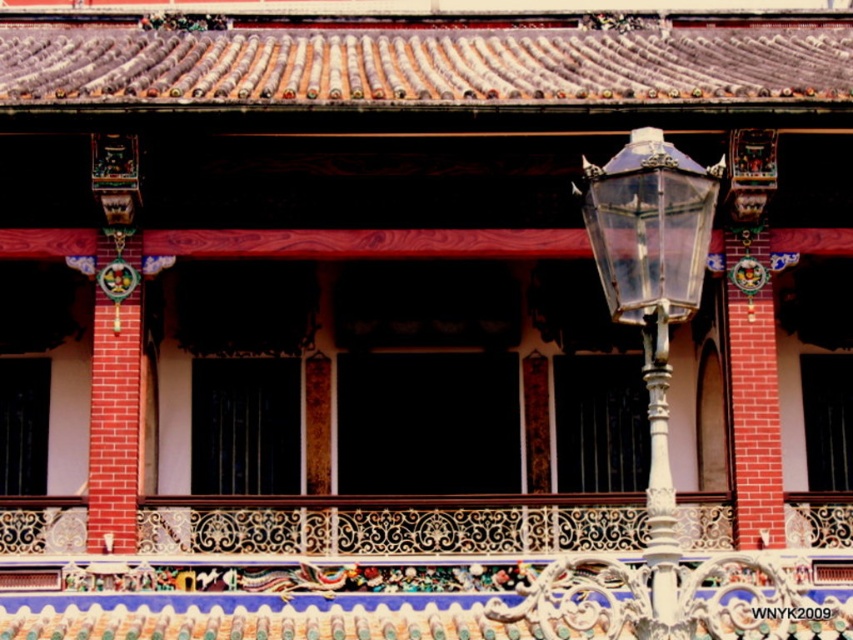
Does decorative wrought iron balcony at center have a lesser width compared to clear glass lantern at right?

Incorrect, decorative wrought iron balcony at center's width is not less than clear glass lantern at right's.

Measure the distance between decorative wrought iron balcony at center and camera.

A distance of 32.07 meters exists between decorative wrought iron balcony at center and camera.

Identify the location of decorative wrought iron balcony at center. The width and height of the screenshot is (853, 640). (347, 576).

Is clear glass lamp post at right behind clear glass lantern at right?

No, it is not.

Does point (668, 618) come behind point (711, 182)?

No.

Find the location of a particular element. This screenshot has height=640, width=853. clear glass lamp post at right is located at coordinates (653, 305).

Which of these two, decorative wrought iron balcony at center or white metal pole at right, stands shorter?

With less height is decorative wrought iron balcony at center.

Is point (437, 611) farther from camera compared to point (660, 416)?

Yes, point (437, 611) is behind point (660, 416).

Where is `decorative wrought iron balcony at center`? This screenshot has height=640, width=853. decorative wrought iron balcony at center is located at coordinates (347, 576).